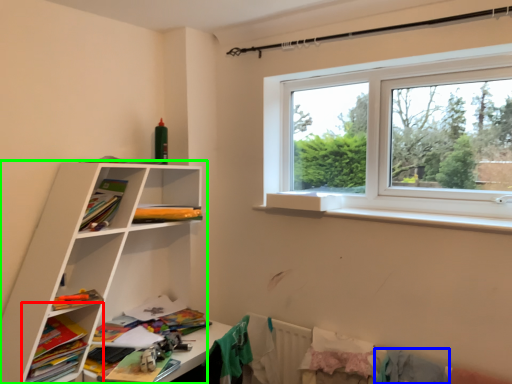
Question: Considering the real-world distances, which object is closest to shelf (highlighted by a red box)? clothing (highlighted by a blue box) or shelf (highlighted by a green box).

Choices:
 (A) clothing
 (B) shelf

Answer: (B)